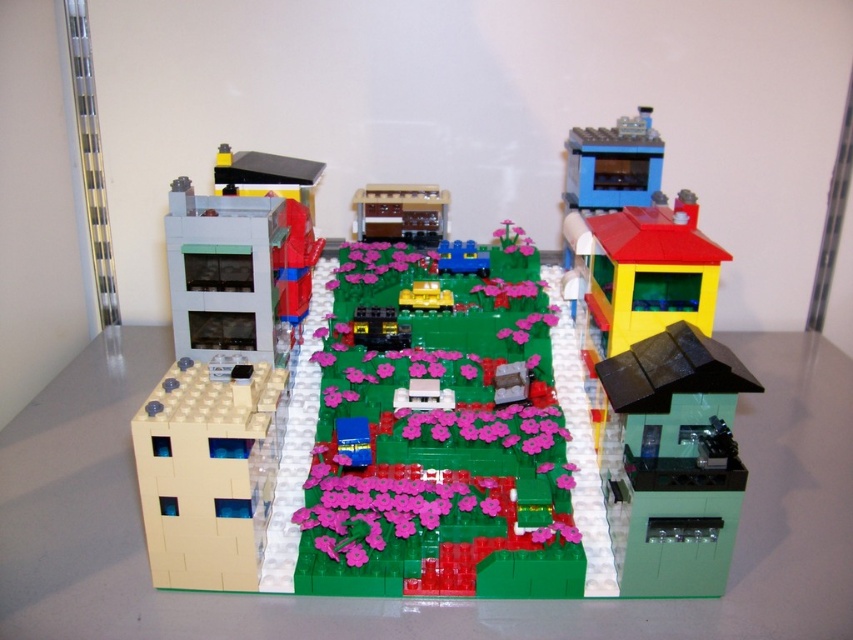
Does green matte house at right have a lesser height compared to smooth gray building at upper left?

In fact, green matte house at right may be taller than smooth gray building at upper left.

Does point (717, 406) come in front of point (239, 208)?

Yes, it is.

Identify the location of green matte house at right. (672, 461).

Is matte brown building at center to the left of yellow plastic car at center from the viewer's perspective?

Yes, matte brown building at center is to the left of yellow plastic car at center.

What do you see at coordinates (399, 212) in the screenshot? The width and height of the screenshot is (853, 640). I see `matte brown building at center` at bounding box center [399, 212].

What are the coordinates of `matte brown building at center` in the screenshot? It's located at (399, 212).

Can you confirm if green matte flower bed at center is wider than smooth plastic house at upper left?

Correct, the width of green matte flower bed at center exceeds that of smooth plastic house at upper left.

Can you confirm if green matte flower bed at center is positioned below smooth plastic house at upper left?

Indeed, green matte flower bed at center is positioned under smooth plastic house at upper left.

Does point (325, 541) lie in front of point (248, 192)?

That is True.

Image resolution: width=853 pixels, height=640 pixels. In order to click on green matte flower bed at center in this screenshot , I will do `click(440, 444)`.